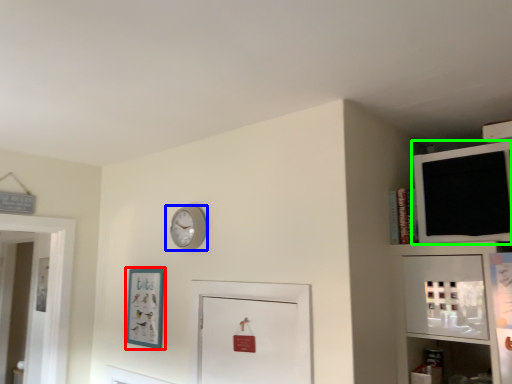
Question: Based on their relative distances, which object is farther from picture frame (highlighted by a red box)? Choose from wall clock (highlighted by a blue box) and medicine cabinet (highlighted by a green box).

Choices:
 (A) wall clock
 (B) medicine cabinet

Answer: (B)